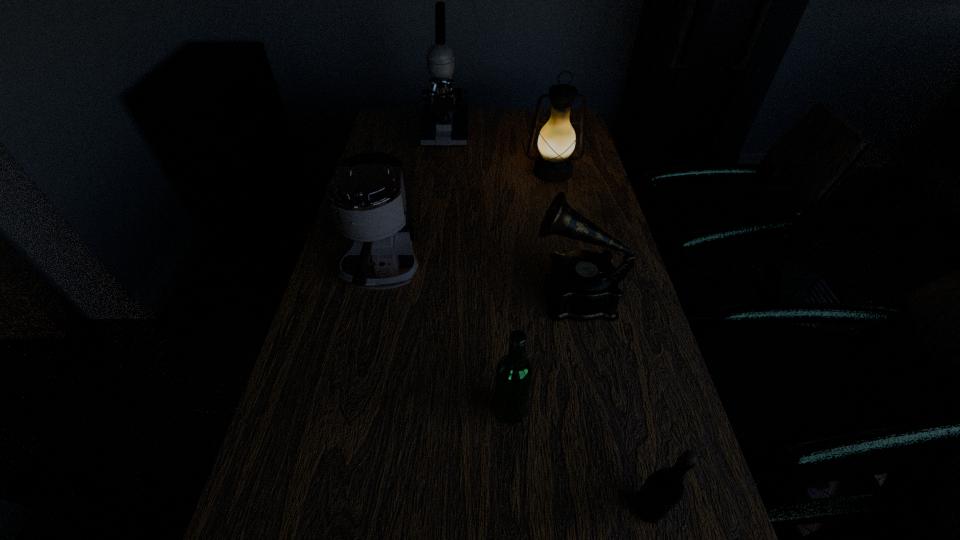
This screenshot has width=960, height=540. In order to click on the tallest object in this screenshot , I will do `click(444, 122)`.

This screenshot has width=960, height=540. I want to click on microscope, so click(x=444, y=122).

Image resolution: width=960 pixels, height=540 pixels. Find the location of `the second farthest object`. the second farthest object is located at coordinates (556, 142).

The height and width of the screenshot is (540, 960). I want to click on coffee maker, so click(366, 195).

Where is `phonograph record`? phonograph record is located at coordinates (582, 285).

The width and height of the screenshot is (960, 540). I want to click on the fourth object from right to left, so click(514, 372).

This screenshot has width=960, height=540. In order to click on the farther beer bottle in this screenshot , I will do `click(514, 372)`.

The width and height of the screenshot is (960, 540). I want to click on the nearest object, so click(x=664, y=489).

I want to click on the nearer beer bottle, so click(x=664, y=489).

Find the location of `vacant space located 0.160m on the front of the farthest object`. vacant space located 0.160m on the front of the farthest object is located at coordinates (441, 173).